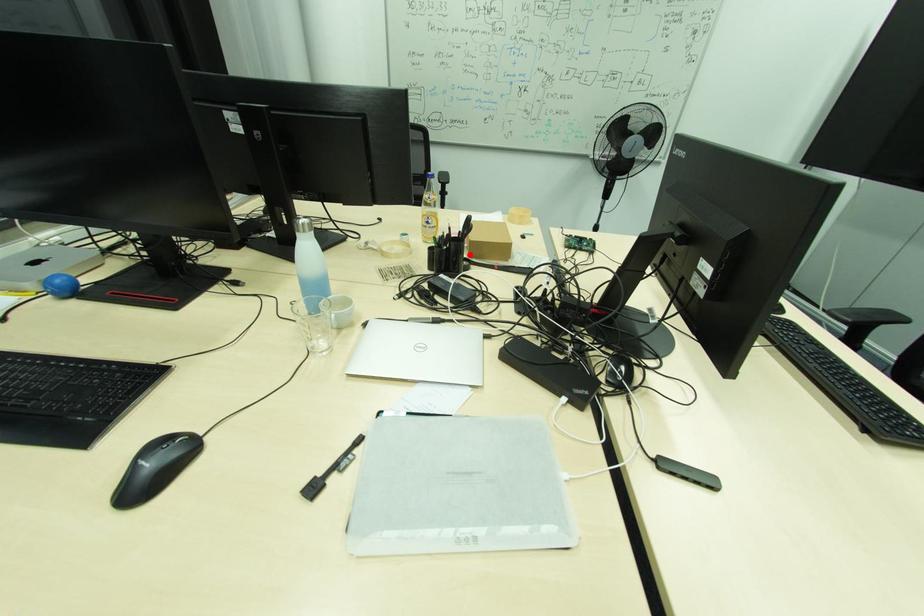
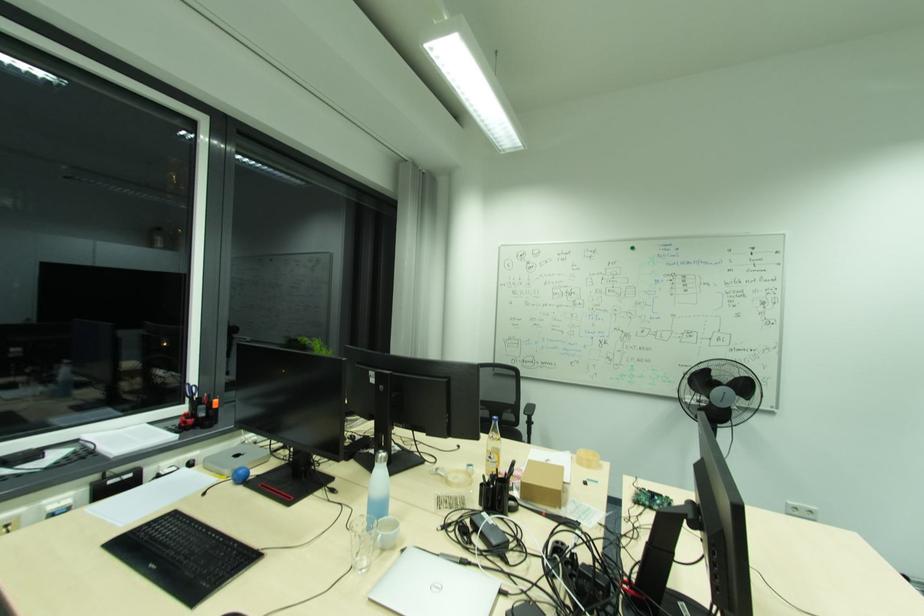
Question: I am providing you with two images of the same scene from different viewpoints. A red point is marked on the first image. Is the red point's position out of view in image 2?

Choices:
 (A) Yes
 (B) No

Answer: (B)